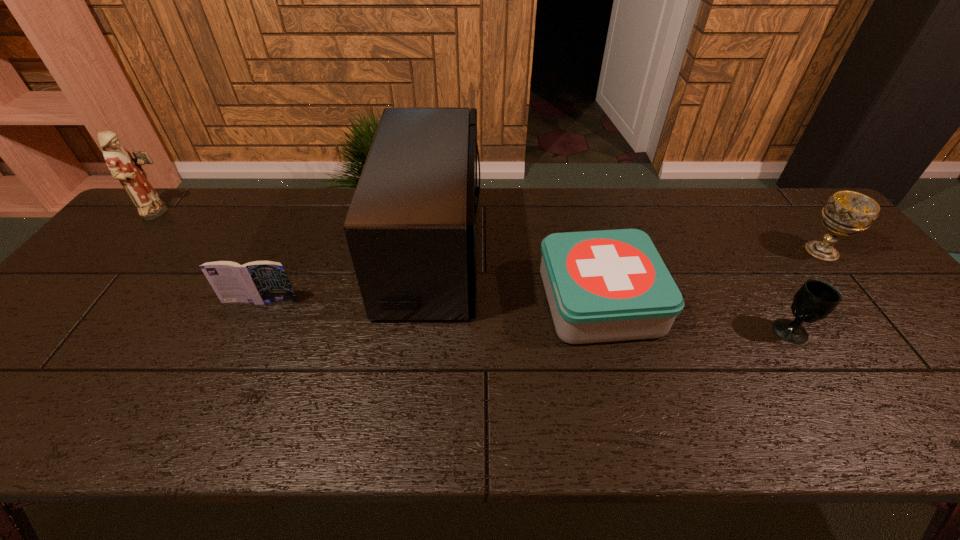
Locate an element on the screen. vacant space located 0.340m on the front of the third tallest object is located at coordinates (920, 372).

Find the location of a particular element. free location located on the left of the second object from right to left is located at coordinates (740, 331).

Image resolution: width=960 pixels, height=540 pixels. Identify the location of free space located on the front cover of the fifth object from right to left. (236, 354).

Find the location of `free space located on the left of the fourth object from left to right`. free space located on the left of the fourth object from left to right is located at coordinates (446, 301).

Locate an element on the screen. microwave_oven located in the far edge section of the desktop is located at coordinates (411, 226).

At what (x,y) coordinates should I click in order to perform the action: click on figurine situated at the far edge. Please return your answer as a coordinate pair (x, y). The height and width of the screenshot is (540, 960). Looking at the image, I should click on (128, 170).

Identify the location of object that is at the left edge. The width and height of the screenshot is (960, 540). (128, 170).

Find the location of `object at the right edge`. object at the right edge is located at coordinates (846, 213).

At what (x,y) coordinates should I click in order to perform the action: click on object that is positioned at the far left corner. Please return your answer as a coordinate pair (x, y). Looking at the image, I should click on (128, 170).

This screenshot has width=960, height=540. In the image, there is a desktop. What are the coordinates of `blank space at the far edge` in the screenshot? It's located at coord(349,206).